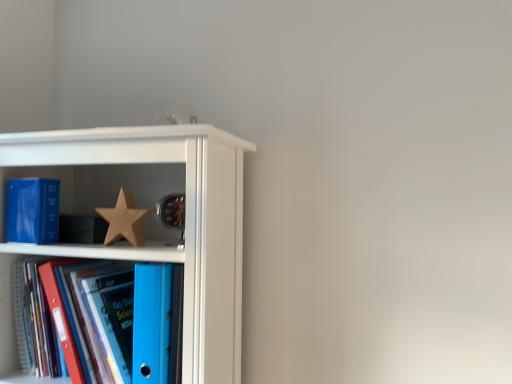
Question: Considering the relative sizes of blue plastic folder at lower left and wooden star at center in the image provided, is blue plastic folder at lower left smaller than wooden star at center?

Choices:
 (A) no
 (B) yes

Answer: (A)

Question: Is wooden star at center a part of blue plastic folder at lower left?

Choices:
 (A) yes
 (B) no

Answer: (B)

Question: Does blue plastic folder at lower left have a greater width compared to wooden star at center?

Choices:
 (A) no
 (B) yes

Answer: (B)

Question: Does blue plastic folder at lower left appear on the right side of wooden star at center?

Choices:
 (A) no
 (B) yes

Answer: (A)

Question: Is the depth of blue plastic folder at lower left greater than that of wooden star at center?

Choices:
 (A) no
 (B) yes

Answer: (A)

Question: Is point (126, 196) closer or farther from the camera than point (44, 185)?

Choices:
 (A) farther
 (B) closer

Answer: (B)

Question: From the image's perspective, relative to matte blue paperback book at left, is wooden star at center above or below?

Choices:
 (A) below
 (B) above

Answer: (A)

Question: Looking at the image, does wooden star at center seem bigger or smaller compared to matte blue paperback book at left?

Choices:
 (A) big
 (B) small

Answer: (B)

Question: From a real-world perspective, is wooden star at center above or below matte blue paperback book at left?

Choices:
 (A) below
 (B) above

Answer: (A)

Question: Is blue plastic folder at lower left taller or shorter than white glossy bookshelf at upper left?

Choices:
 (A) short
 (B) tall

Answer: (A)

Question: Would you say blue plastic folder at lower left is inside or outside white glossy bookshelf at upper left?

Choices:
 (A) inside
 (B) outside

Answer: (A)

Question: Relative to white glossy bookshelf at upper left, is blue plastic folder at lower left in front or behind?

Choices:
 (A) behind
 (B) front

Answer: (A)

Question: From a real-world perspective, is blue plastic folder at lower left above or below white glossy bookshelf at upper left?

Choices:
 (A) above
 (B) below

Answer: (B)

Question: From their relative heights in the image, would you say matte blue paperback book at left is taller or shorter than wooden star at center?

Choices:
 (A) short
 (B) tall

Answer: (B)

Question: In the image, is matte blue paperback book at left positioned in front of or behind wooden star at center?

Choices:
 (A) behind
 (B) front

Answer: (A)